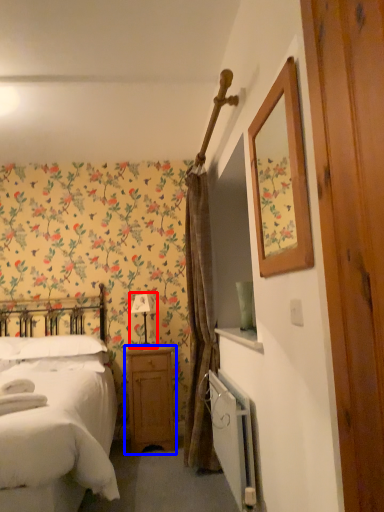
Question: Which of the following is the closest to the observer, table lamp (highlighted by a red box) or nightstand (highlighted by a blue box)?

Choices:
 (A) table lamp
 (B) nightstand

Answer: (B)